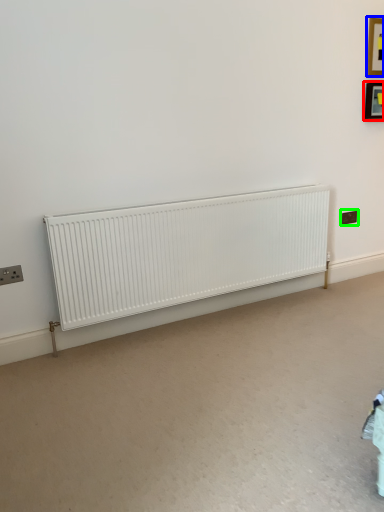
Question: Which is farther away from picture frame (highlighted by a red box)? picture frame (highlighted by a blue box) or electric outlet (highlighted by a green box)?

Choices:
 (A) picture frame
 (B) electric outlet

Answer: (B)